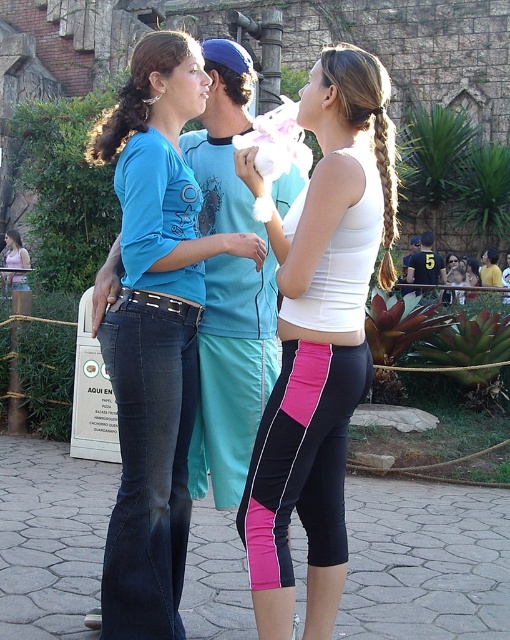
Question: Is matte blue shirt at center positioned before brown hair at center?

Choices:
 (A) no
 (B) yes

Answer: (B)

Question: Which point is closer to the camera?

Choices:
 (A) (389, 211)
 (B) (269, 344)
 (C) (280, 532)

Answer: (C)

Question: Among these points, which one is farthest from the camera?

Choices:
 (A) (135, 582)
 (B) (256, 321)
 (C) (365, 372)
 (D) (159, 545)

Answer: (B)

Question: Does dark blue denim jeans at left have a greater width compared to brown hair at center?

Choices:
 (A) no
 (B) yes

Answer: (A)

Question: Can you confirm if matte blue shirt at center is smaller than pink/black athletic leggings at center?

Choices:
 (A) no
 (B) yes

Answer: (A)

Question: Which of these objects is positioned closest to the pink/black athletic leggings at center?

Choices:
 (A) white matte tank top at center
 (B) brown hair at center
 (C) matte blue shorts at center
 (D) dark blue denim jeans at left

Answer: (A)